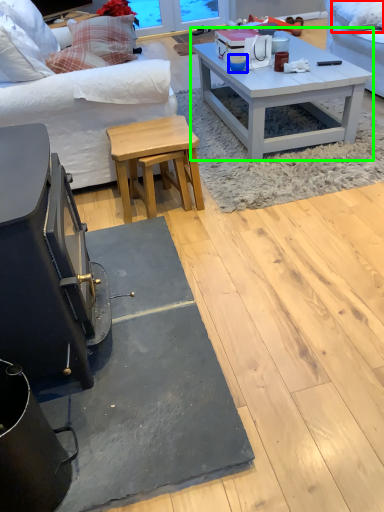
Question: Which object is positioned farthest from pillow (highlighted by a red box)? Select from coffee cup (highlighted by a blue box) and coffee table (highlighted by a green box).

Choices:
 (A) coffee cup
 (B) coffee table

Answer: (A)